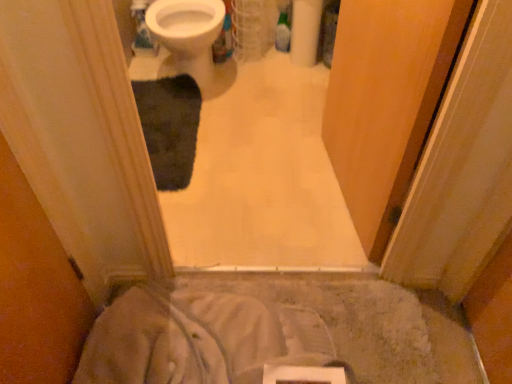
Where is `free space between white glossy bidet at upper center and dark gray plush bath mat at center`? free space between white glossy bidet at upper center and dark gray plush bath mat at center is located at coordinates (200, 124).